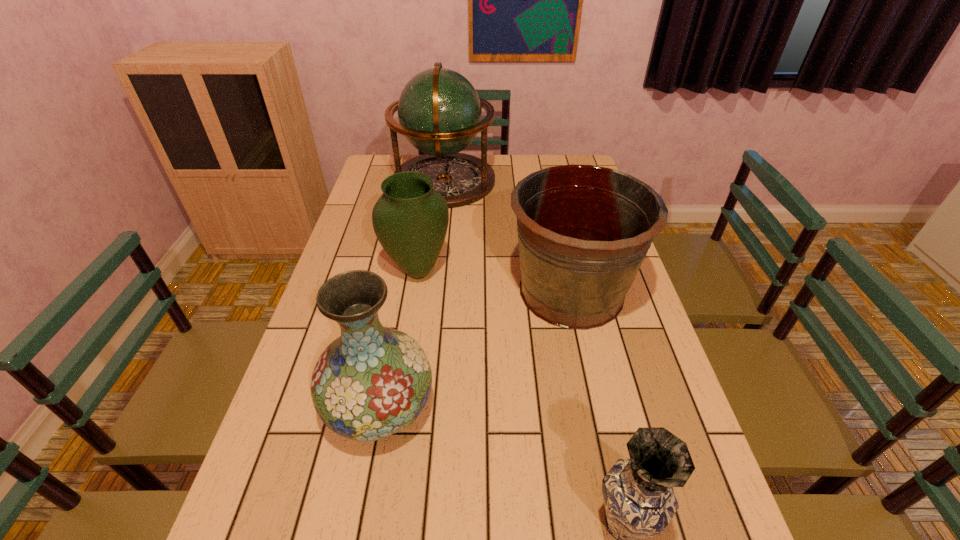
Select which object is the closest to the second nearest vase. Please provide its 2D coordinates. Your answer should be formatted as a tuple, i.e. [(x, y)], where the tuple contains the x and y coordinates of a point satisfying the conditions above.

[(583, 231)]

Point out which object is positioned as the second nearest to the bucket. Please provide its 2D coordinates. Your answer should be formatted as a tuple, i.e. [(x, y)], where the tuple contains the x and y coordinates of a point satisfying the conditions above.

[(371, 382)]

Identify the location of vase that is the third closest to the globe. This screenshot has width=960, height=540. (639, 499).

Choose which vase is the second nearest neighbor to the farthest vase. Please provide its 2D coordinates. Your answer should be formatted as a tuple, i.e. [(x, y)], where the tuple contains the x and y coordinates of a point satisfying the conditions above.

[(639, 499)]

Image resolution: width=960 pixels, height=540 pixels. I want to click on vacant space that satisfies the following two spatial constraints: 1. on the back side of the tallest vase; 2. on the right side of the bucket, so click(401, 291).

Identify the location of free region that satisfies the following two spatial constraints: 1. on the front-facing side of the tallest object; 2. on the back side of the bucket. (431, 291).